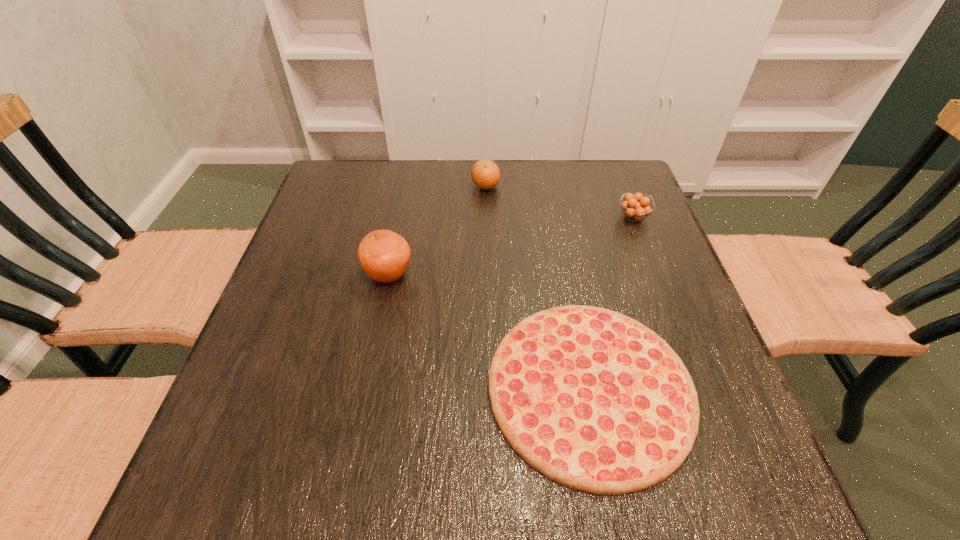
Identify the location of free location located on the front of the third tallest object. The image size is (960, 540). (646, 249).

You are a GUI agent. You are given a task and a screenshot of the screen. Output one action in this format:
    pyautogui.click(x=<x>, y=<y>)
    Task: Click on the vacant space located 0.240m on the back of the shortest object
    Image resolution: width=960 pixels, height=540 pixels.
    Given the screenshot: What is the action you would take?
    pyautogui.click(x=561, y=234)

This screenshot has height=540, width=960. I want to click on object located at the near edge, so click(x=591, y=398).

Where is `orange fruit that is at the right edge`? The height and width of the screenshot is (540, 960). orange fruit that is at the right edge is located at coordinates (636, 206).

The width and height of the screenshot is (960, 540). I want to click on pizza situated at the right edge, so click(591, 398).

The height and width of the screenshot is (540, 960). I want to click on object present at the far right corner, so click(x=636, y=206).

In order to click on object located in the near right corner section of the desktop in this screenshot , I will do `click(591, 398)`.

Where is `free space at the far edge of the desktop`? The height and width of the screenshot is (540, 960). free space at the far edge of the desktop is located at coordinates coord(443,205).

Identify the location of free space at the left edge of the desktop. (283, 300).

At what (x,y) coordinates should I click in order to perform the action: click on free space at the right edge of the desktop. Please return your answer as a coordinate pair (x, y). This screenshot has width=960, height=540. Looking at the image, I should click on (640, 235).